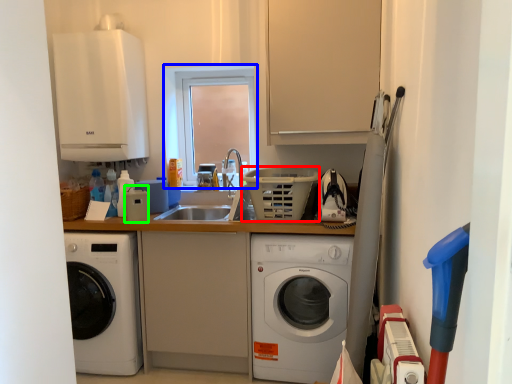
Question: Estimate the real-world distances between objects in this image. Which object is farther from basket (highlighted by a red box), window (highlighted by a blue box) or appliance (highlighted by a green box)?

Choices:
 (A) window
 (B) appliance

Answer: (B)